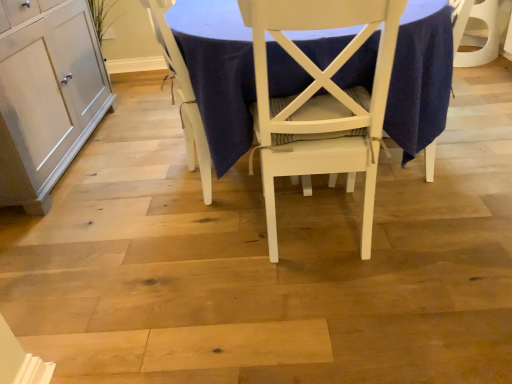
Question: Is white painted wood chair at center, which ranks as the 1th chair in right-to-left order, inside or outside of white wood table at center?

Choices:
 (A) outside
 (B) inside

Answer: (B)

Question: Is point (298, 102) closer or farther from the camera than point (429, 140)?

Choices:
 (A) farther
 (B) closer

Answer: (B)

Question: Estimate the real-world distances between objects in this image. Which object is farther from the matte white cabinet at left?

Choices:
 (A) white painted wood chair at center, the second chair in the left-to-right sequence
 (B) white wood table at center
 (C) white wood chair at center, the second chair from the right

Answer: (A)

Question: Which is nearer to the matte white cabinet at left?

Choices:
 (A) white wood chair at center, the second chair from the right
 (B) white painted wood chair at center, which ranks as the 1th chair in right-to-left order
 (C) white wood table at center

Answer: (A)